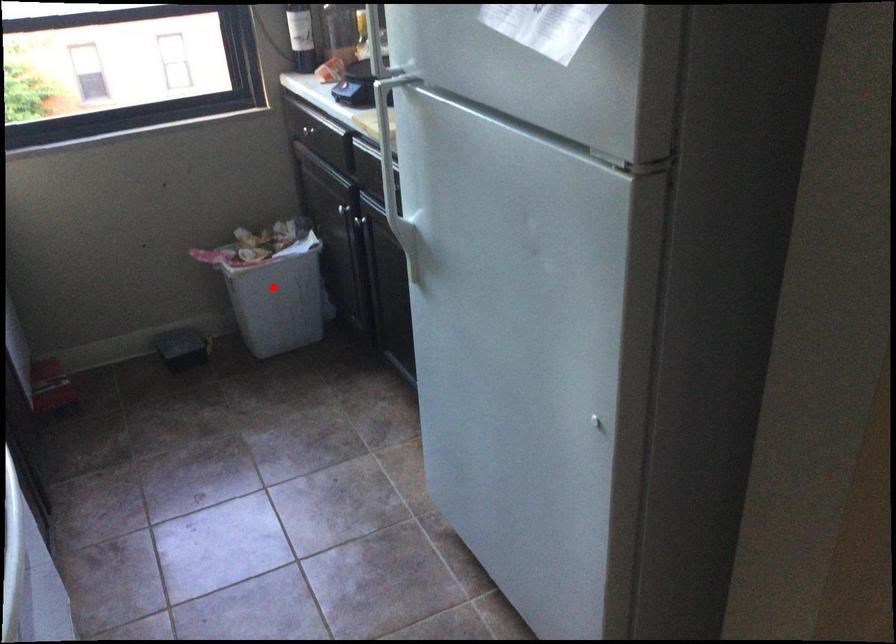
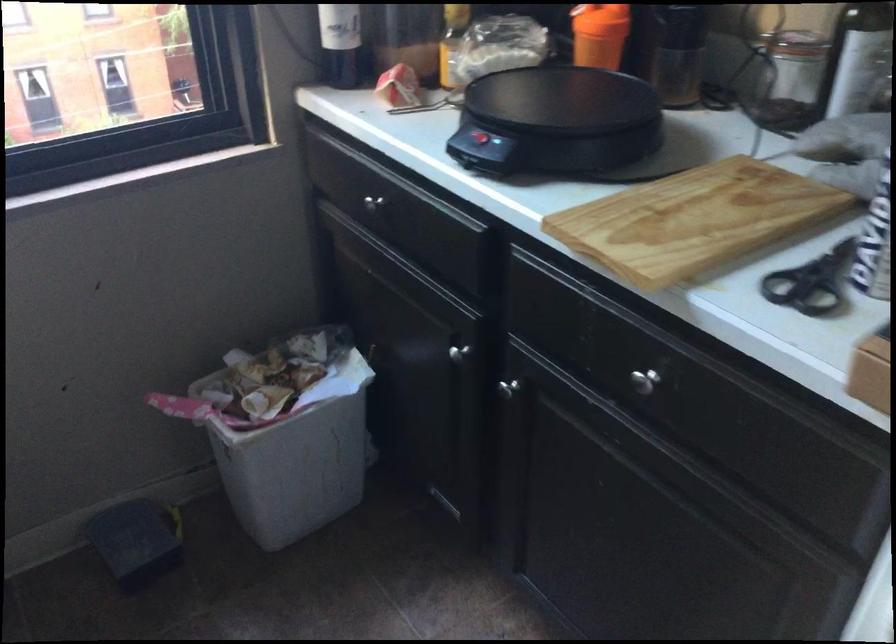
Question: I am providing you with two images of the same scene from different viewpoints. Image1 has a red point marked. In image2, the corresponding 3D location appears at what relative position? Reply with the corresponding letter.

Choices:
 (A) Closer
 (B) Farther

Answer: (A)